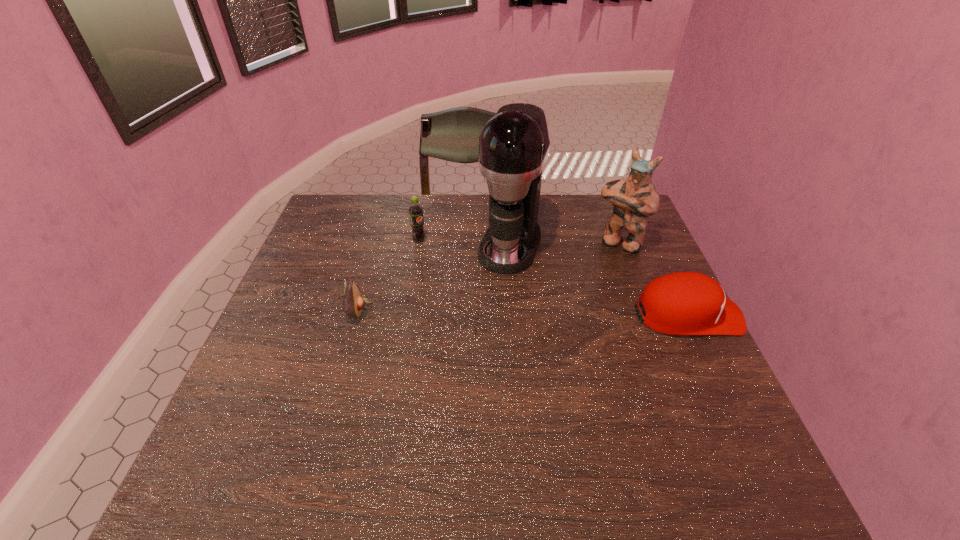
Find the location of a particular element. The height and width of the screenshot is (540, 960). the leftmost object is located at coordinates (353, 301).

Locate an element on the screen. This screenshot has height=540, width=960. baseball cap is located at coordinates (683, 303).

At what (x,y) coordinates should I click in order to perform the action: click on the second tallest object. Please return your answer as a coordinate pair (x, y). The image size is (960, 540). Looking at the image, I should click on (634, 199).

The width and height of the screenshot is (960, 540). What are the coordinates of `the third object from right to left` in the screenshot? It's located at (514, 144).

Find the location of a particular element. The height and width of the screenshot is (540, 960). coffee maker is located at coordinates (514, 144).

What are the coordinates of `the second object from left to right` in the screenshot? It's located at (415, 210).

You are a GUI agent. You are given a task and a screenshot of the screen. Output one action in this format:
    pyautogui.click(x=<x>, y=<y>)
    Task: Click on the third tallest object
    
    Given the screenshot: What is the action you would take?
    click(415, 210)

The image size is (960, 540). Identify the location of vacant region located 0.350m on the seed side of the leftmost object. (507, 310).

The width and height of the screenshot is (960, 540). I want to click on free location located 0.350m on the front-facing side of the second tallest object, so click(x=557, y=328).

I want to click on vacant position located on the front-facing side of the second tallest object, so click(588, 282).